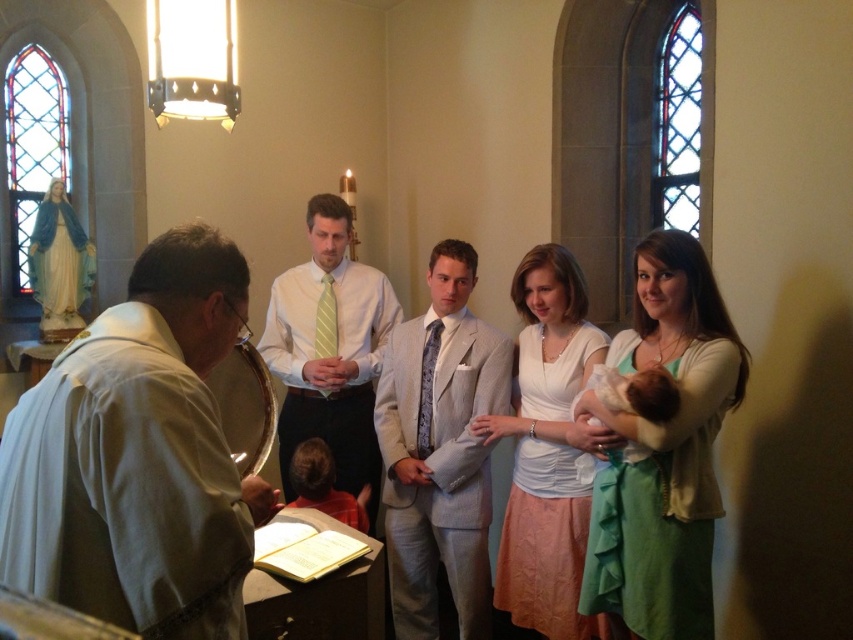
You are attending a religious ceremony in a church and notice two dresses at the center of the scene. Which dress is positioned closer to you, the green textured dress at center or the white satin dress at center?

The green textured dress at center is closer to the viewer than the white satin dress at center.